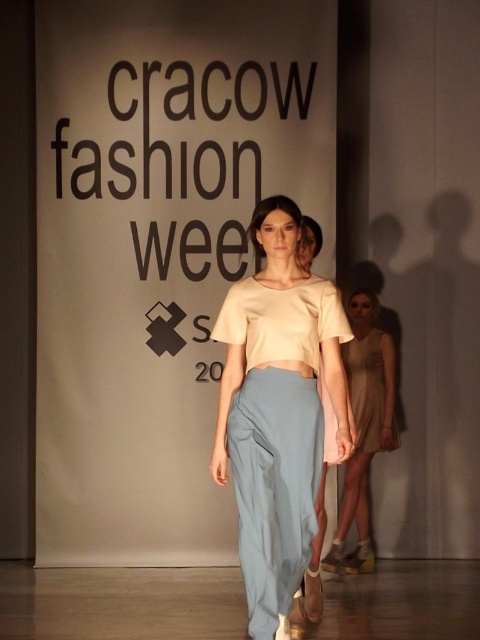
Question: Which point appears closest to the camera in this image?

Choices:
 (A) (335, 563)
 (B) (356, 419)
 (C) (283, 244)

Answer: (C)

Question: Does light beige fabric dress at center have a smaller size compared to light beige sheer dress at center?

Choices:
 (A) no
 (B) yes

Answer: (A)

Question: Does matte beige top at center appear on the left side of light beige sheer dress at center?

Choices:
 (A) yes
 (B) no

Answer: (A)

Question: Which object is closer to the camera taking this photo?

Choices:
 (A) light beige fabric dress at center
 (B) matte beige top at center

Answer: (B)

Question: Which point is closer to the camera?

Choices:
 (A) light beige fabric dress at center
 (B) matte beige top at center
 (C) light beige sheer dress at center

Answer: (B)

Question: Can you confirm if light beige fabric dress at center is thinner than light beige sheer dress at center?

Choices:
 (A) yes
 (B) no

Answer: (B)